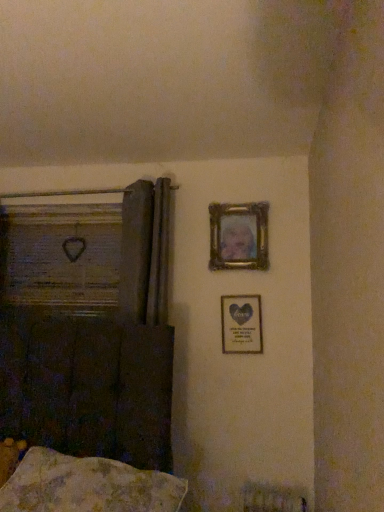
Question: Is point (64, 267) closer or farther from the camera than point (31, 458)?

Choices:
 (A) closer
 (B) farther

Answer: (B)

Question: Is wooden frame at left to the left or to the right of fluffy beige pillow at lower left in the image?

Choices:
 (A) right
 (B) left

Answer: (B)

Question: Estimate the real-world distances between objects in this image. Which object is closer to the fluffy beige pillow at lower left?

Choices:
 (A) gold metallic picture frame at upper center, positioned as the second picture frame in bottom-to-top order
 (B) wooden frame at left
 (C) metallic gold picture frame at center-right, the second picture frame positioned from the top

Answer: (C)

Question: Which object is the farthest from the wooden frame at left?

Choices:
 (A) metallic gold picture frame at center-right, the second picture frame positioned from the top
 (B) fluffy beige pillow at lower left
 (C) gold metallic picture frame at upper center, positioned as the second picture frame in bottom-to-top order

Answer: (B)